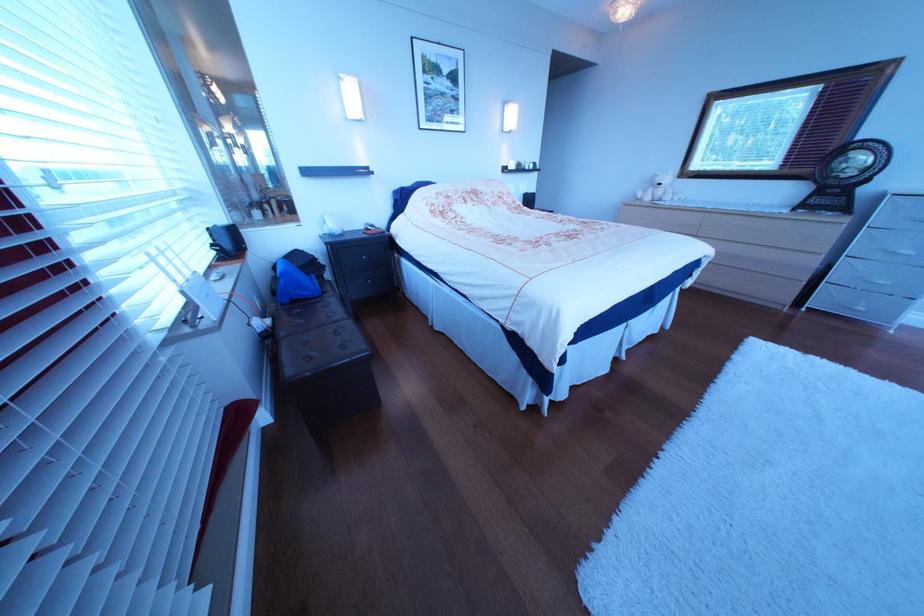
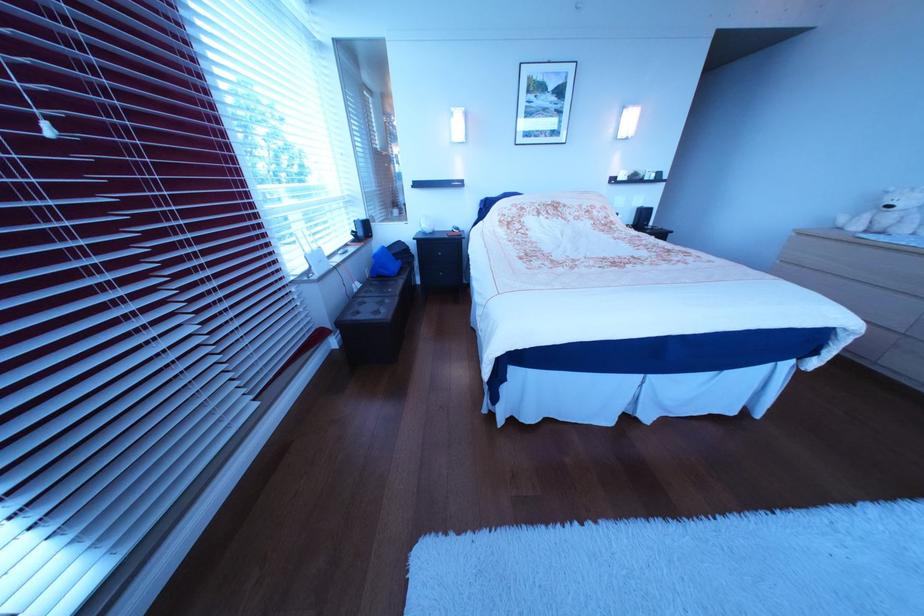
In the second image, find the point that corresponds to pixel 356 233 in the first image.

(445, 233)